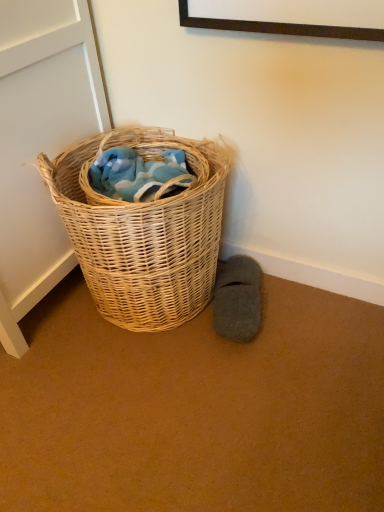
The width and height of the screenshot is (384, 512). In order to click on woven natural basket at lower left in this screenshot , I will do `click(143, 231)`.

Describe the element at coordinates (143, 231) in the screenshot. I see `woven natural basket at lower left` at that location.

Measure the distance between point (161, 244) and camera.

Point (161, 244) and camera are 3.29 feet apart.

In order to face gray felt slipper at lower right, should I rotate leftwards or rightwards?

You should rotate right by 6.411 degrees.

This screenshot has height=512, width=384. Describe the element at coordinates (238, 298) in the screenshot. I see `gray felt slipper at lower right` at that location.

Where is `gray felt slipper at lower right`? gray felt slipper at lower right is located at coordinates (238, 298).

This screenshot has height=512, width=384. Identify the location of woven natural basket at lower left. (143, 231).

Considering the relative positions of woven natural basket at lower left and gray felt slipper at lower right in the image provided, is woven natural basket at lower left to the right of gray felt slipper at lower right from the viewer's perspective?

No, woven natural basket at lower left is not to the right of gray felt slipper at lower right.

Consider the image. Considering the positions of objects woven natural basket at lower left and gray felt slipper at lower right in the image provided, who is in front, woven natural basket at lower left or gray felt slipper at lower right?

woven natural basket at lower left is in front.

Is point (202, 184) closer or farther from the camera than point (253, 269)?

Point (202, 184) appears to be closer to the viewer than point (253, 269).

From the image's perspective, which one is positioned higher, woven natural basket at lower left or gray felt slipper at lower right?

woven natural basket at lower left.

From a real-world perspective, is woven natural basket at lower left positioned above or below gray felt slipper at lower right?

Clearly, from a real-world perspective, woven natural basket at lower left is above gray felt slipper at lower right.

Does woven natural basket at lower left have a lesser width compared to gray felt slipper at lower right?

No, woven natural basket at lower left is not thinner than gray felt slipper at lower right.

Considering the sizes of objects woven natural basket at lower left and gray felt slipper at lower right in the image provided, who is taller, woven natural basket at lower left or gray felt slipper at lower right?

woven natural basket at lower left is taller.

Is woven natural basket at lower left bigger than gray felt slipper at lower right?

Correct, woven natural basket at lower left is larger in size than gray felt slipper at lower right.

Would you say gray felt slipper at lower right is part of woven natural basket at lower left's contents?

That's incorrect, gray felt slipper at lower right is not inside woven natural basket at lower left.

Is there a large distance between woven natural basket at lower left and gray felt slipper at lower right?

No, woven natural basket at lower left is in close proximity to gray felt slipper at lower right.

Does woven natural basket at lower left turn towards gray felt slipper at lower right?

No.

This screenshot has width=384, height=512. Identify the location of footwear on the right of woven natural basket at lower left. 238,298.

Considering the positions of objects gray felt slipper at lower right and woven natural basket at lower left in the image provided, who is more to the right, gray felt slipper at lower right or woven natural basket at lower left?

gray felt slipper at lower right is more to the right.

Considering their positions, is gray felt slipper at lower right located in front of or behind woven natural basket at lower left?

Clearly, gray felt slipper at lower right is behind woven natural basket at lower left.

Which is closer, (231, 329) or (121, 303)?

The point (231, 329) is more forward.

From the image's perspective, which is above, gray felt slipper at lower right or woven natural basket at lower left?

woven natural basket at lower left appears higher in the image.

From a real-world perspective, which object rests below the other?

In real-world perspective, gray felt slipper at lower right is lower.

Considering the sizes of gray felt slipper at lower right and woven natural basket at lower left in the image, is gray felt slipper at lower right wider or thinner than woven natural basket at lower left?

In the image, gray felt slipper at lower right appears to be more narrow than woven natural basket at lower left.

Considering the sizes of gray felt slipper at lower right and woven natural basket at lower left in the image, is gray felt slipper at lower right taller or shorter than woven natural basket at lower left?

Clearly, gray felt slipper at lower right is shorter compared to woven natural basket at lower left.

Is gray felt slipper at lower right smaller than woven natural basket at lower left?

Yes, gray felt slipper at lower right is smaller than woven natural basket at lower left.

Is gray felt slipper at lower right not within woven natural basket at lower left?

Yes, gray felt slipper at lower right is not within woven natural basket at lower left.

Is gray felt slipper at lower right next to woven natural basket at lower left?

No, gray felt slipper at lower right is not beside woven natural basket at lower left.

Could you tell me if gray felt slipper at lower right is turned towards woven natural basket at lower left?

No, gray felt slipper at lower right is not turned towards woven natural basket at lower left.

What's the angular difference between gray felt slipper at lower right and woven natural basket at lower left's facing directions?

gray felt slipper at lower right and woven natural basket at lower left are facing 14.2 degrees away from each other.

How far apart are gray felt slipper at lower right and woven natural basket at lower left?

gray felt slipper at lower right is 27.29 centimeters from woven natural basket at lower left.

The height and width of the screenshot is (512, 384). In the image, there is a woven natural basket at lower left. What are the coordinates of `footwear below it (from the image's perspective)` in the screenshot? It's located at (238, 298).

Find the location of `footwear that appears below the woven natural basket at lower left (from the image's perspective)`. footwear that appears below the woven natural basket at lower left (from the image's perspective) is located at coordinates (238, 298).

Locate an element on the screen. picnic basket lying above the gray felt slipper at lower right (from the image's perspective) is located at coordinates (143, 231).